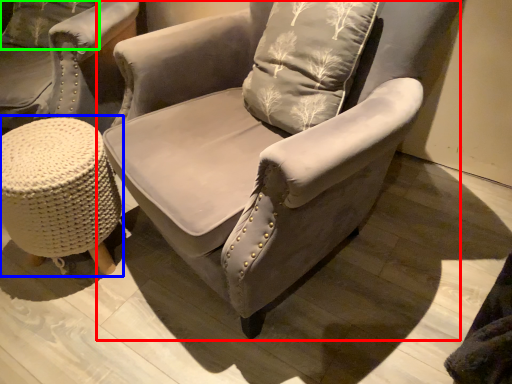
Question: Based on their relative distances, which object is nearer to chair (highlighted by a red box)? Choose from music stool (highlighted by a blue box) and pillow (highlighted by a green box).

Choices:
 (A) music stool
 (B) pillow

Answer: (A)